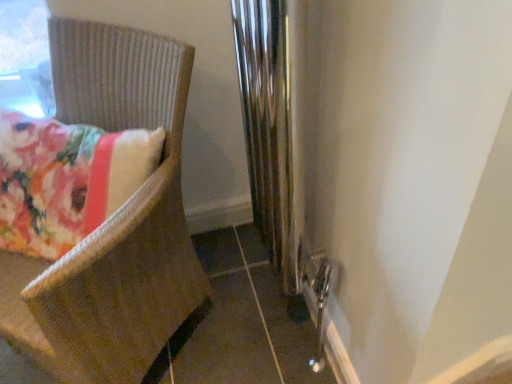
Find the location of a particular element. This screenshot has width=512, height=384. woven wicker chair at left is located at coordinates (114, 222).

What do you see at coordinates (114, 222) in the screenshot? I see `woven wicker chair at left` at bounding box center [114, 222].

What is the approximate width of woven wicker chair at left?

23.73 inches.

Find the location of `woven wicker chair at left`. woven wicker chair at left is located at coordinates (114, 222).